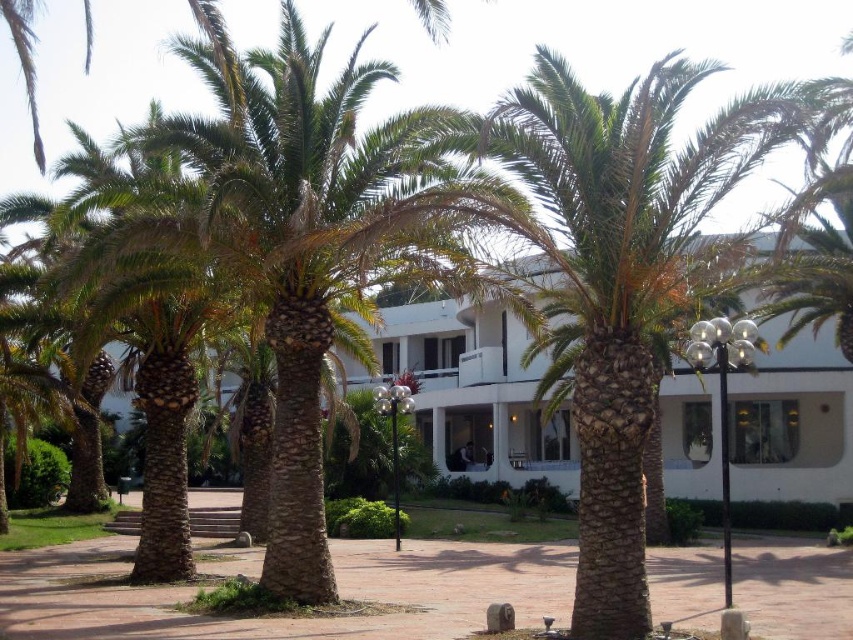
You are standing at the entrance of the modern white building and want to walk to the green textured palm tree at center. Which direction should you head to reach it?

The green textured palm tree at center is located at coordinates 0.425 on the x axis and 0.726 on the y axis, so you should head towards the direction of the coordinates to reach it.

You are standing at the edge of the paved area in the scene and want to walk to the white smooth building at center. There is a green textured palm tree at center blocking your path. Can you walk around it to reach the building?

The green textured palm tree at center is 36.07 feet away from the white smooth building at center. Since the palm tree is blocking your path, you can walk around it to reach the building as there is enough space between the tree and the building to navigate around.